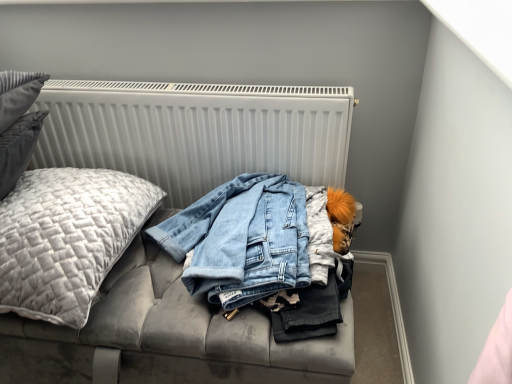
Question: Could velvet grey couch at center be considered to be inside quilted gray pillow at left?

Choices:
 (A) no
 (B) yes

Answer: (A)

Question: Considering the relative positions of quilted gray pillow at left and velvet grey couch at center in the image provided, is quilted gray pillow at left behind velvet grey couch at center?

Choices:
 (A) yes
 (B) no

Answer: (A)

Question: Is quilted gray pillow at left beside velvet grey couch at center?

Choices:
 (A) no
 (B) yes

Answer: (A)

Question: From a real-world perspective, is quilted gray pillow at left below velvet grey couch at center?

Choices:
 (A) yes
 (B) no

Answer: (B)

Question: Does quilted gray pillow at left have a lesser height compared to velvet grey couch at center?

Choices:
 (A) yes
 (B) no

Answer: (A)

Question: Can you confirm if quilted gray pillow at left is bigger than velvet grey couch at center?

Choices:
 (A) no
 (B) yes

Answer: (A)

Question: Is white ribbed radiator at upper center oriented away from velvet grey couch at center?

Choices:
 (A) no
 (B) yes

Answer: (A)

Question: Can you confirm if white ribbed radiator at upper center is bigger than velvet grey couch at center?

Choices:
 (A) yes
 (B) no

Answer: (B)

Question: Considering the relative sizes of white ribbed radiator at upper center and velvet grey couch at center in the image provided, is white ribbed radiator at upper center shorter than velvet grey couch at center?

Choices:
 (A) yes
 (B) no

Answer: (B)

Question: From the image's perspective, is white ribbed radiator at upper center below velvet grey couch at center?

Choices:
 (A) no
 (B) yes

Answer: (A)

Question: Is white ribbed radiator at upper center smaller than velvet grey couch at center?

Choices:
 (A) no
 (B) yes

Answer: (B)

Question: Considering the relative sizes of white ribbed radiator at upper center and velvet grey couch at center in the image provided, is white ribbed radiator at upper center wider than velvet grey couch at center?

Choices:
 (A) no
 (B) yes

Answer: (A)

Question: Is quilted gray pillow at left smaller than white ribbed radiator at upper center?

Choices:
 (A) yes
 (B) no

Answer: (B)